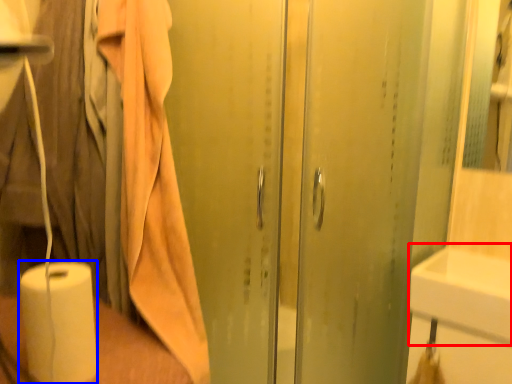
Question: Which point is closer to the camera, sink (highlighted by a red box) or paper towel (highlighted by a blue box)?

Choices:
 (A) sink
 (B) paper towel

Answer: (B)